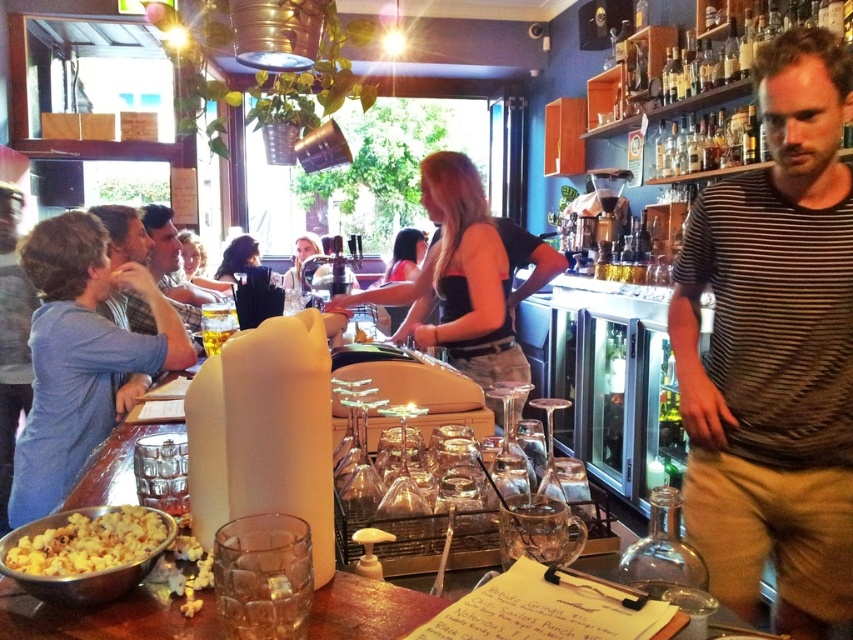
Looking at this image, between gray cotton shirt at left and plaid shirt at left, which one is positioned lower?

plaid shirt at left is below.

What do you see at coordinates (123, 234) in the screenshot? The image size is (853, 640). I see `gray cotton shirt at left` at bounding box center [123, 234].

Find the location of a particular element. gray cotton shirt at left is located at coordinates [123, 234].

Locate an element on the screen. gray cotton shirt at left is located at coordinates [x=123, y=234].

Can you confirm if gray cotton shirt at left is wider than yellow popcorn at lower left?

Yes, gray cotton shirt at left is wider than yellow popcorn at lower left.

Measure the distance between point (154,332) and camera.

8.13 feet

Find the location of a particular element. This screenshot has width=853, height=640. gray cotton shirt at left is located at coordinates (123, 234).

Does point (112, 545) come behind point (148, 218)?

No, it is in front of (148, 218).

Is golden popcorn at lower left thinner than plaid shirt at left?

Correct, golden popcorn at lower left's width is less than plaid shirt at left's.

At what (x,y) coordinates should I click in order to perform the action: click on golden popcorn at lower left. Please return your answer as a coordinate pair (x, y). Looking at the image, I should click on (90, 541).

Locate an element on the screen. This screenshot has height=640, width=853. golden popcorn at lower left is located at coordinates (90, 541).